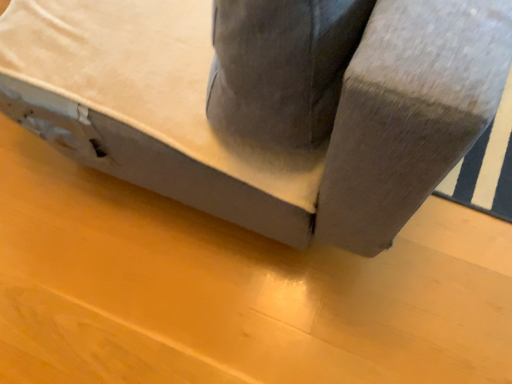
You are a GUI agent. You are given a task and a screenshot of the screen. Output one action in this format:
    pyautogui.click(x=<x>, y=<y>)
    Task: Click on the vacant space situated above matte gray plywood at lower center (from a real-world perspective)
    
    Given the screenshot: What is the action you would take?
    pyautogui.click(x=162, y=265)